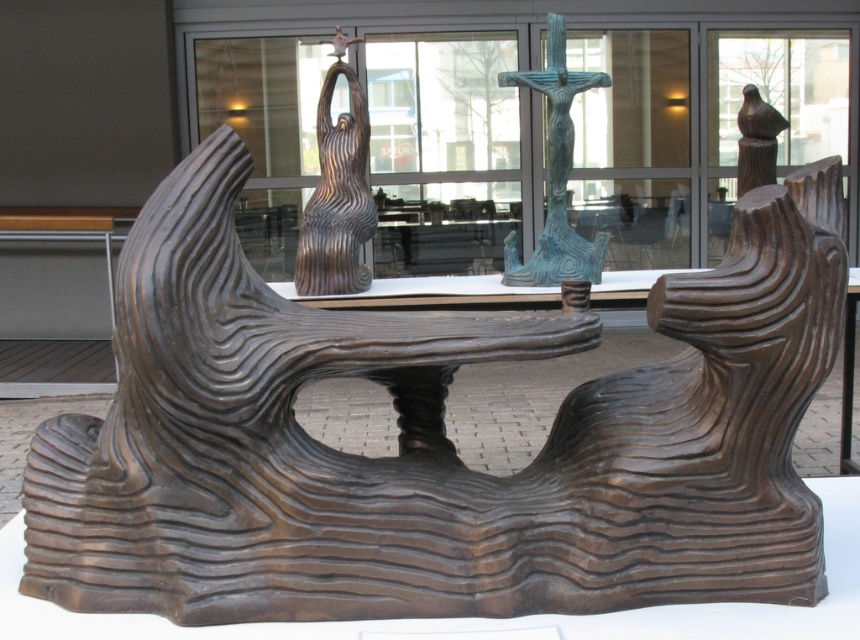
Question: Is wooden sculpture at center below green patina metal crucifix at center?

Choices:
 (A) yes
 (B) no

Answer: (B)

Question: Which object is farther from the camera taking this photo?

Choices:
 (A) green patina metal crucifix at center
 (B) wooden sculpture at center

Answer: (A)

Question: Does wooden sculpture at center appear on the left side of green patina metal crucifix at center?

Choices:
 (A) yes
 (B) no

Answer: (A)

Question: Is wooden sculpture at center to the right of green patina metal crucifix at center from the viewer's perspective?

Choices:
 (A) yes
 (B) no

Answer: (B)